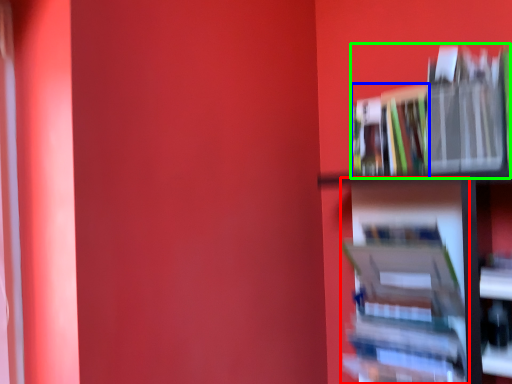
Question: Based on their relative distances, which object is nearer to book (highlighted by a red box)? Choose from book (highlighted by a blue box) and book (highlighted by a green box).

Choices:
 (A) book
 (B) book

Answer: (B)